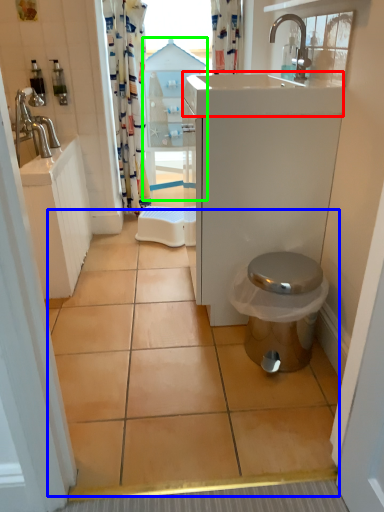
Question: Considering the real-world distances, which object is closest to counter top (highlighted by a red box)? ceramic tile (highlighted by a blue box) or glass door (highlighted by a green box).

Choices:
 (A) ceramic tile
 (B) glass door

Answer: (A)